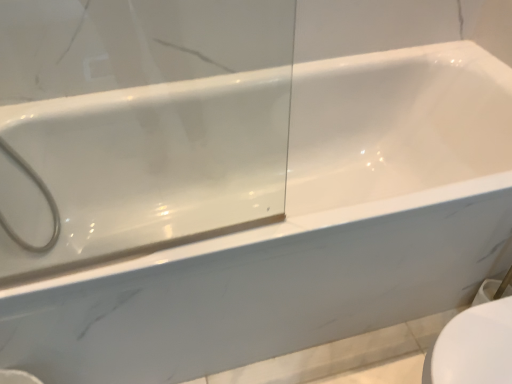
Question: Considering their positions, is white matte showerhead at left located in front of or behind white glossy toilet bowl at lower right?

Choices:
 (A) front
 (B) behind

Answer: (B)

Question: In terms of size, does white matte showerhead at left appear bigger or smaller than white glossy toilet bowl at lower right?

Choices:
 (A) big
 (B) small

Answer: (B)

Question: Is white matte showerhead at left situated inside white glossy toilet bowl at lower right or outside?

Choices:
 (A) inside
 (B) outside

Answer: (B)

Question: From a real-world perspective, is white glossy toilet bowl at lower right positioned above or below white matte showerhead at left?

Choices:
 (A) below
 (B) above

Answer: (A)

Question: Looking at the image, does white glossy toilet bowl at lower right seem bigger or smaller compared to white matte showerhead at left?

Choices:
 (A) small
 (B) big

Answer: (B)

Question: Is white glossy toilet bowl at lower right wider or thinner than white matte showerhead at left?

Choices:
 (A) wide
 (B) thin

Answer: (A)

Question: Which is correct: white glossy toilet bowl at lower right is inside white matte showerhead at left, or outside of it?

Choices:
 (A) inside
 (B) outside

Answer: (B)